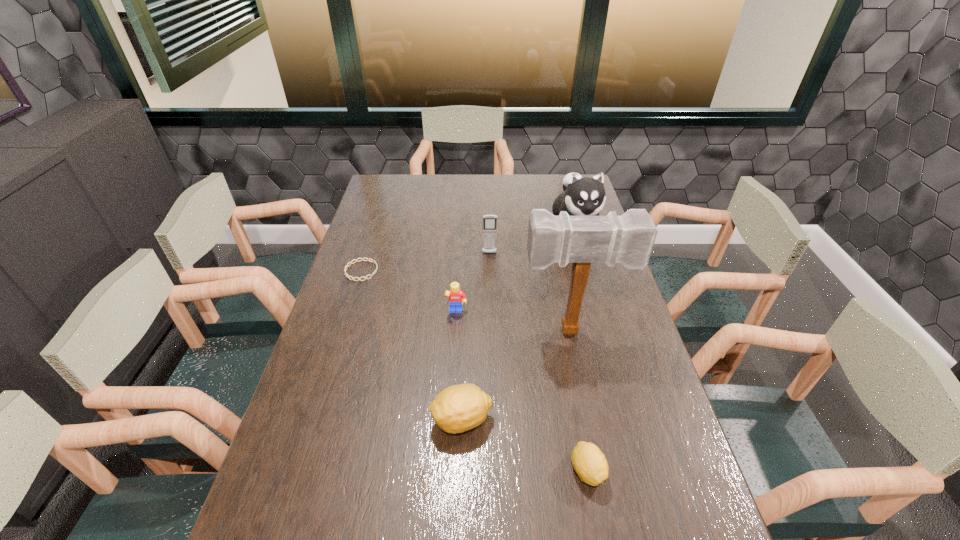
With all lemons evenly spaced, where should an extra lemon be placed on the left to continue the pattern? Please point out a vacant space. Please provide its 2D coordinates. Your answer should be formatted as a tuple, i.e. [(x, y)], where the tuple contains the x and y coordinates of a point satisfying the conditions above.

[(357, 377)]